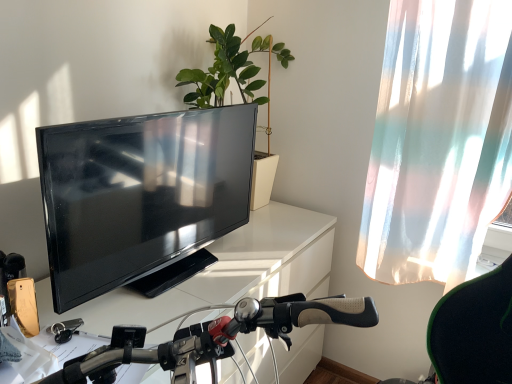
Question: Can you confirm if translucent fabric curtain at right is taller than green matte plant at upper center?

Choices:
 (A) yes
 (B) no

Answer: (A)

Question: Is translucent fabric curtain at right to the left of green matte plant at upper center from the viewer's perspective?

Choices:
 (A) no
 (B) yes

Answer: (A)

Question: Is translucent fabric curtain at right to the right of green matte plant at upper center from the viewer's perspective?

Choices:
 (A) no
 (B) yes

Answer: (B)

Question: Is green matte plant at upper center surrounded by translucent fabric curtain at right?

Choices:
 (A) no
 (B) yes

Answer: (A)

Question: Can you confirm if translucent fabric curtain at right is shorter than green matte plant at upper center?

Choices:
 (A) yes
 (B) no

Answer: (B)

Question: From the image's perspective, is translucent fabric curtain at right above green matte plant at upper center?

Choices:
 (A) yes
 (B) no

Answer: (B)

Question: Considering the relative sizes of matte black tv at left and white glossy desk at center in the image provided, is matte black tv at left smaller than white glossy desk at center?

Choices:
 (A) yes
 (B) no

Answer: (A)

Question: Does matte black tv at left contain white glossy desk at center?

Choices:
 (A) yes
 (B) no

Answer: (B)

Question: Is matte black tv at left outside white glossy desk at center?

Choices:
 (A) yes
 (B) no

Answer: (A)

Question: Considering the relative sizes of matte black tv at left and white glossy desk at center in the image provided, is matte black tv at left thinner than white glossy desk at center?

Choices:
 (A) no
 (B) yes

Answer: (B)

Question: Would you consider matte black tv at left to be distant from white glossy desk at center?

Choices:
 (A) no
 (B) yes

Answer: (A)

Question: From a real-world perspective, does matte black tv at left sit lower than white glossy desk at center?

Choices:
 (A) yes
 (B) no

Answer: (B)

Question: Are white glossy desk at center and green matte plant at upper center beside each other?

Choices:
 (A) yes
 (B) no

Answer: (B)